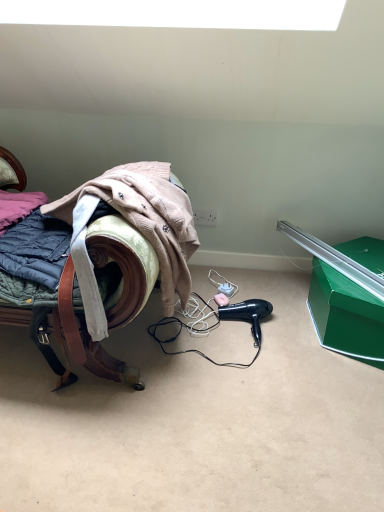
You are a GUI agent. You are given a task and a screenshot of the screen. Output one action in this format:
    pyautogui.click(x=<x>, y=<y>)
    Task: Click on the free space between black plastic hair dryer at lower center and green cardboard box at lower right
    Image resolution: width=384 pixels, height=512 pixels.
    Given the screenshot: What is the action you would take?
    pyautogui.click(x=289, y=318)